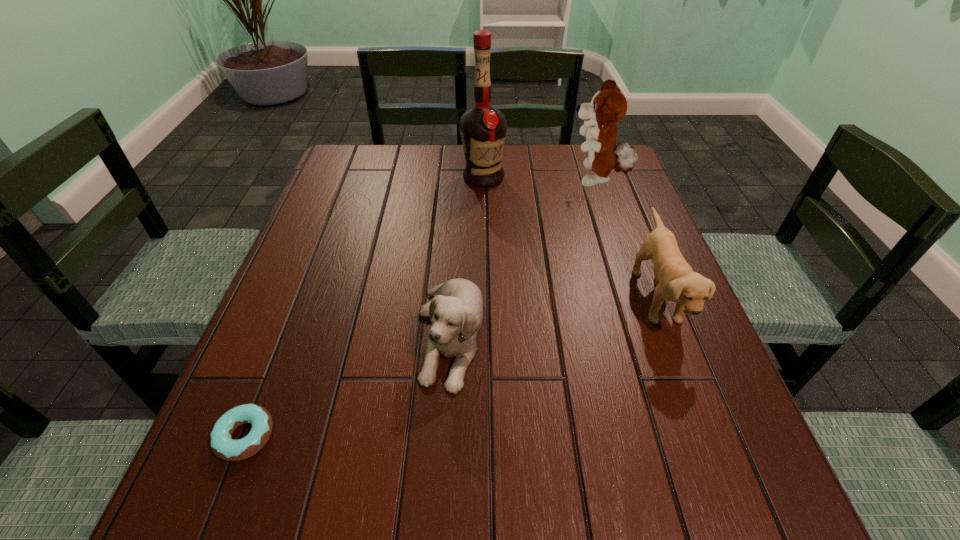
Where is `the tallest object`? the tallest object is located at coordinates (483, 128).

Identify the location of the second tallest object. (608, 106).

Locate an element on the screen. This screenshot has width=960, height=540. the farthest puppy is located at coordinates (608, 106).

At what (x,y) coordinates should I click in order to perform the action: click on the leftmost puppy. Please return your answer as a coordinate pair (x, y). Looking at the image, I should click on (456, 311).

Where is `the shortest object`? The image size is (960, 540). the shortest object is located at coordinates (223, 446).

You are a GUI agent. You are given a task and a screenshot of the screen. Output one action in this format:
    pyautogui.click(x=<x>, y=<y>)
    Task: Click on the leftmost object
    The image size is (960, 540).
    Given the screenshot: What is the action you would take?
    pyautogui.click(x=223, y=446)

You are a GUI agent. You are given a task and a screenshot of the screen. Output one action in this format:
    pyautogui.click(x=<x>, y=<y>)
    Task: Click on the vacant space positioned 0.330m on the front and back of the tallest object
    This screenshot has width=960, height=540.
    Given the screenshot: What is the action you would take?
    pyautogui.click(x=484, y=273)

Where is `vacant space located on the face of the farthest puppy`? vacant space located on the face of the farthest puppy is located at coordinates (424, 180).

Find the location of a particular element. The image size is (960, 540). vacant region located on the face of the farthest puppy is located at coordinates (428, 180).

The image size is (960, 540). Identify the location of vacant area located on the face of the farthest puppy. (538, 180).